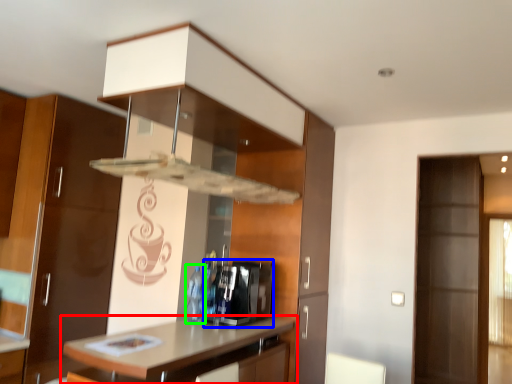
Question: Which object is positioned farthest from countertop (highlighted by a red box)? Select from appliance (highlighted by a blue box) and bottle (highlighted by a green box).

Choices:
 (A) appliance
 (B) bottle

Answer: (B)